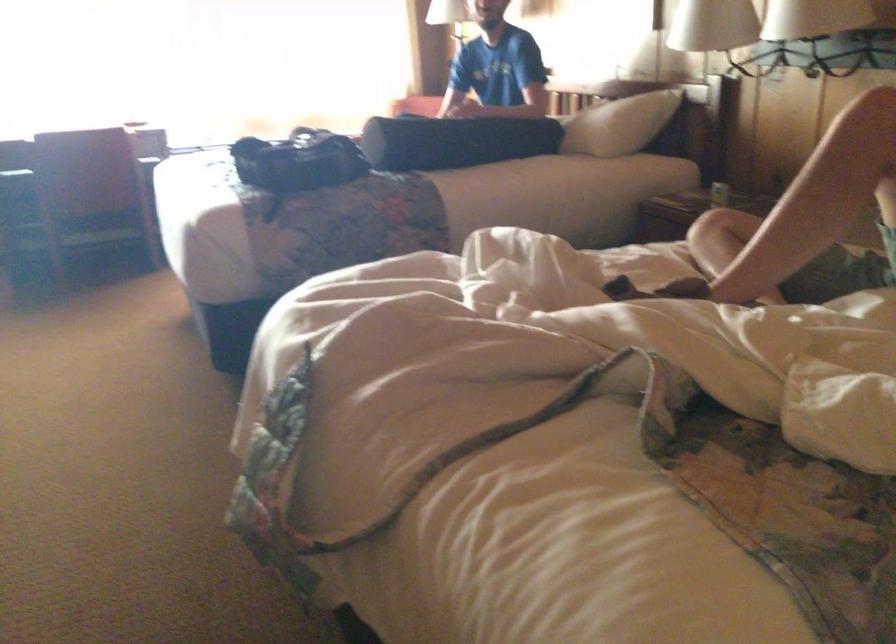
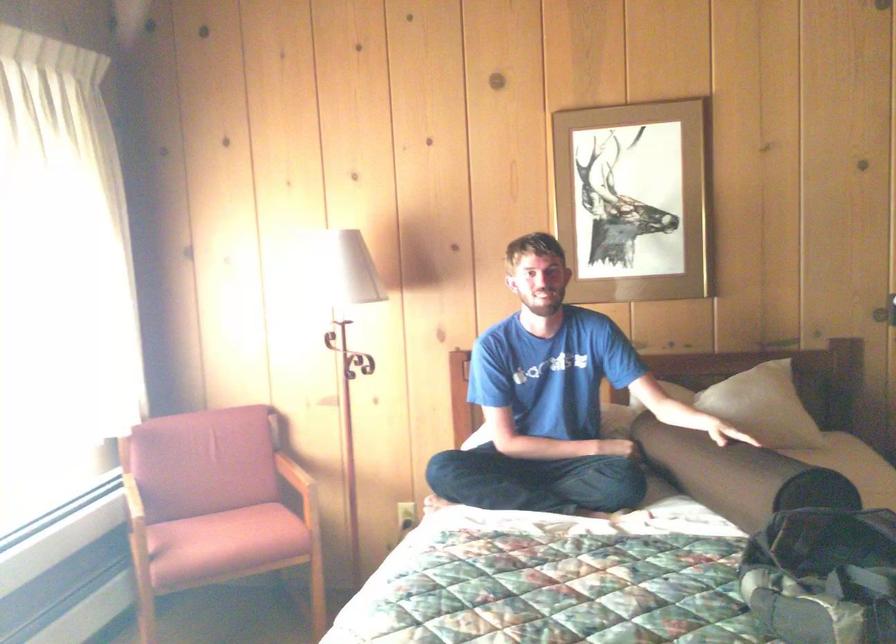
Question: I am providing you with two images of the same scene from different viewpoints. Please identify which objects are invisible in image2.

Choices:
 (A) chair armrest
 (B) black bolster pillow
 (C) silver cooking pot
 (D) chair sitting surface

Answer: (B)